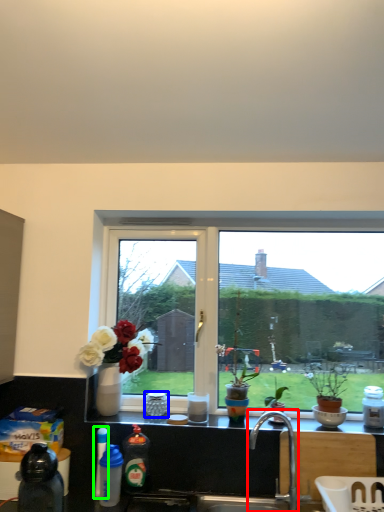
Question: Which object is positioned farthest from tap (highlighted by a red box)? Select from coffee cup (highlighted by a blue box) and bottle (highlighted by a green box).

Choices:
 (A) coffee cup
 (B) bottle

Answer: (B)